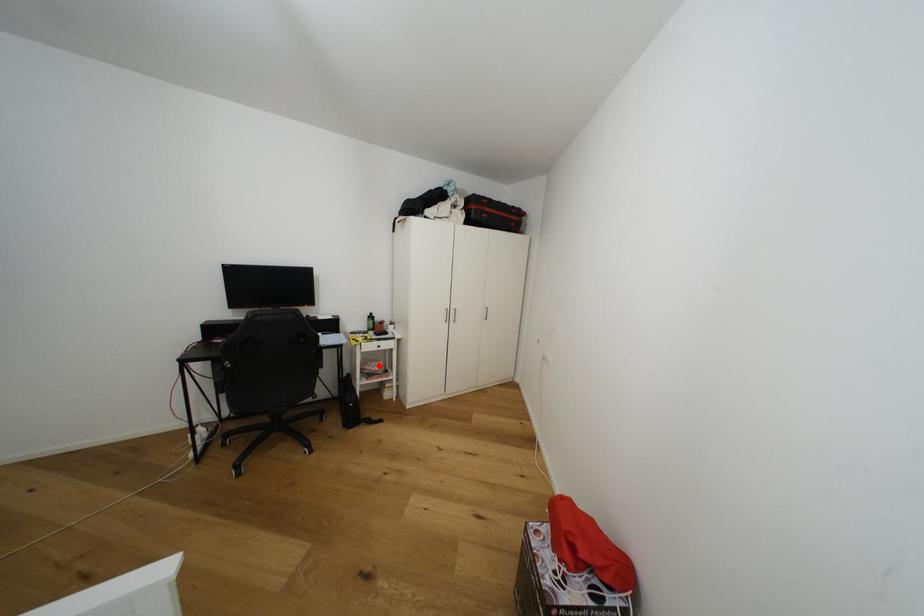
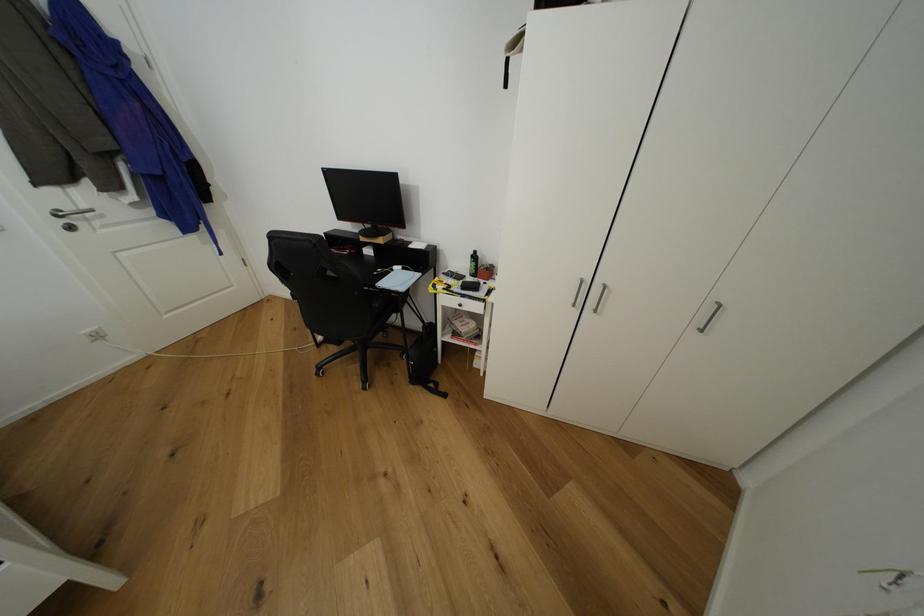
Locate, in the second image, the point that corresponds to the highlighted location in the first image.

(472, 322)